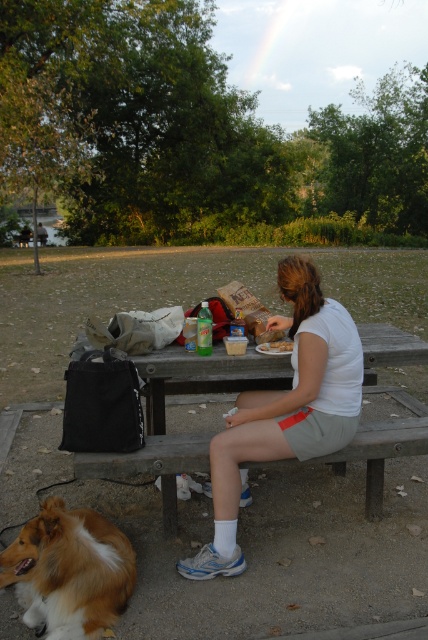
Question: Which point is farther from the camera taking this photo?

Choices:
 (A) tap(294, 352)
 (B) tap(148, 408)

Answer: (B)

Question: Can you confirm if golden fur dog at lower left is thinner than smooth plastic container at center?

Choices:
 (A) no
 (B) yes

Answer: (A)

Question: Can you confirm if white cotton shirt at center is bigger than wooden picnic table at center?

Choices:
 (A) no
 (B) yes

Answer: (B)

Question: Considering the real-world distances, which object is closest to the golden fur dog at lower left?

Choices:
 (A) white cotton shirt at center
 (B) wooden picnic table at center

Answer: (A)

Question: Is golden fur dog at lower left bigger than smooth plastic container at center?

Choices:
 (A) no
 (B) yes

Answer: (B)

Question: Which point is farther from the camera taking this photo?

Choices:
 (A) (383, 358)
 (B) (285, 282)
 (C) (56, 586)
 (D) (279, 349)

Answer: (A)